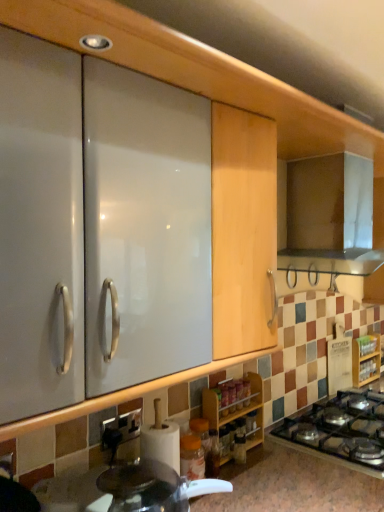
This screenshot has height=512, width=384. Find the location of `free space above wooden spice rack at lower center, marked as the 2th cabinetry in a back-to-front arrangement (from a real-world perspective)`. free space above wooden spice rack at lower center, marked as the 2th cabinetry in a back-to-front arrangement (from a real-world perspective) is located at coordinates (232, 379).